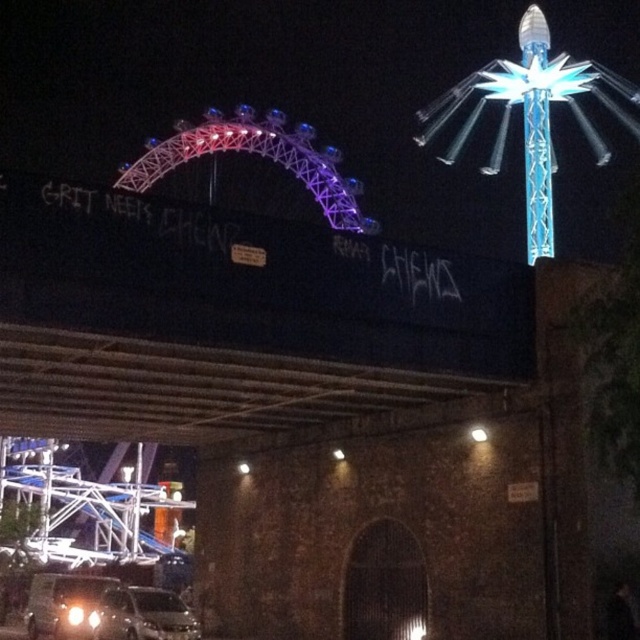
Question: Can you confirm if metallic silver car at lower left is positioned above white glossy headlight at lower left?

Choices:
 (A) no
 (B) yes

Answer: (B)

Question: Which object is farther from the camera taking this photo?

Choices:
 (A) shiny silver car at lower left
 (B) metallic silver car at lower left

Answer: (A)

Question: Is shiny silver car at lower left to the right of white glossy headlight at lower left from the viewer's perspective?

Choices:
 (A) no
 (B) yes

Answer: (A)

Question: Considering the real-world distances, which object is closest to the white glossy headlight at lower left?

Choices:
 (A) metallic silver car at lower left
 (B) shiny silver car at lower left

Answer: (B)

Question: Is shiny silver car at lower left thinner than white glossy headlight at lower left?

Choices:
 (A) yes
 (B) no

Answer: (B)

Question: Which of the following is the farthest from the observer?

Choices:
 (A) white glossy headlight at lower left
 (B) metallic silver car at lower left
 (C) shiny silver car at lower left

Answer: (A)